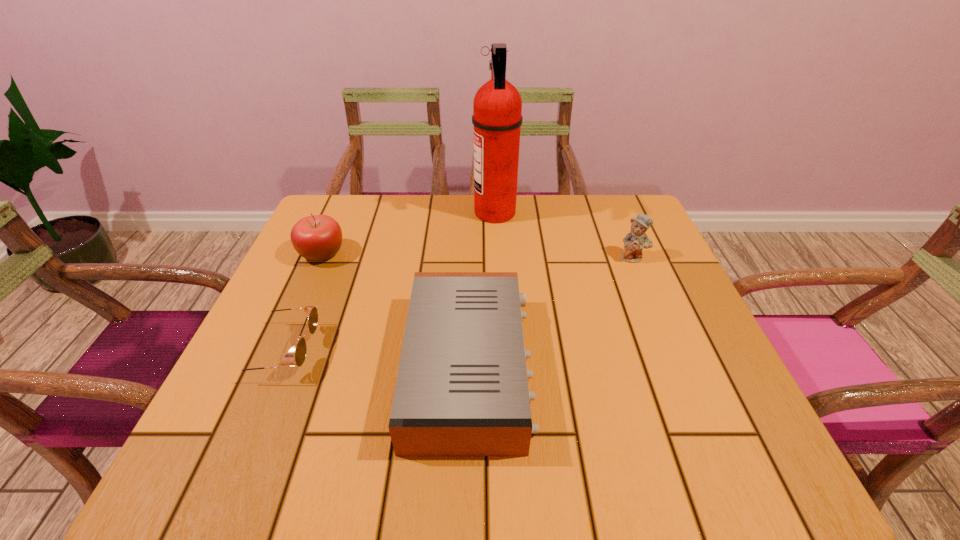
At what (x,y) coordinates should I click in order to perform the action: click on vacant space situated 0.280m on the right of the apple. Please return your answer as a coordinate pair (x, y). Looking at the image, I should click on (458, 254).

Where is `vacant space located 0.090m on the control panel of the radio receiver`? The width and height of the screenshot is (960, 540). vacant space located 0.090m on the control panel of the radio receiver is located at coordinates (578, 367).

This screenshot has width=960, height=540. In order to click on free location located 0.130m on the front lenses of the shortest object in this screenshot , I will do `click(380, 352)`.

The image size is (960, 540). I want to click on fire extinguisher positioned at the far edge, so 497,106.

Find the location of a particular element. The width and height of the screenshot is (960, 540). apple positioned at the far edge is located at coordinates (319, 237).

You are a GUI agent. You are given a task and a screenshot of the screen. Output one action in this format:
    pyautogui.click(x=<x>, y=<y>)
    Task: Click on the object located in the near edge section of the desktop
    
    Given the screenshot: What is the action you would take?
    pyautogui.click(x=462, y=389)

At what (x,y) coordinates should I click in order to perform the action: click on apple at the left edge. Please return your answer as a coordinate pair (x, y). Image resolution: width=960 pixels, height=540 pixels. Looking at the image, I should click on (319, 237).

Find the location of a particular element. The image size is (960, 540). sunglasses at the left edge is located at coordinates (311, 311).

Image resolution: width=960 pixels, height=540 pixels. I want to click on object that is at the right edge, so click(635, 241).

This screenshot has width=960, height=540. Find the location of `object that is at the far left corner`. object that is at the far left corner is located at coordinates (319, 237).